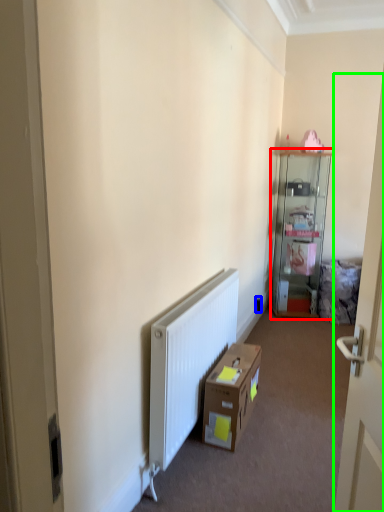
Question: Considering the real-world distances, which object is closest to cabinetry (highlighted by a red box)? electric outlet (highlighted by a blue box) or door (highlighted by a green box).

Choices:
 (A) electric outlet
 (B) door

Answer: (A)